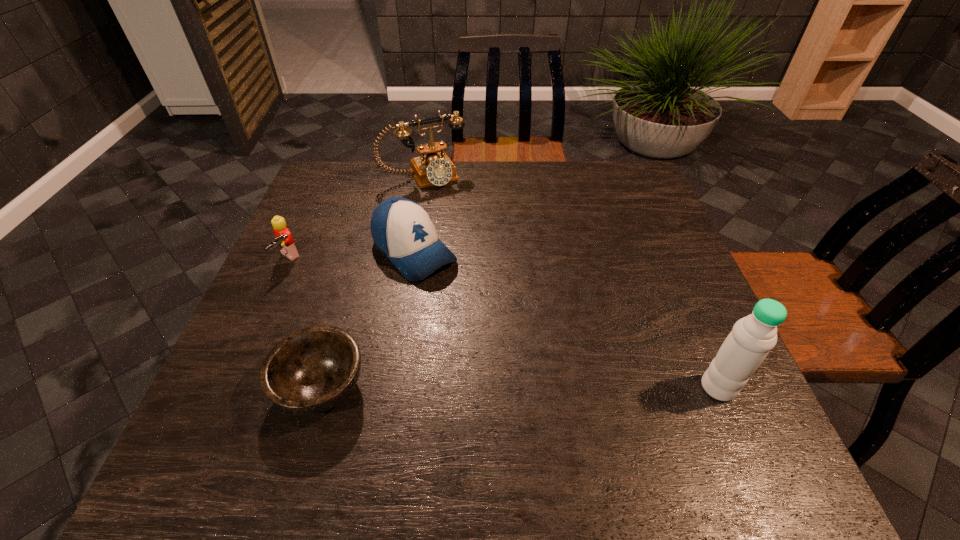
In the image, there is a desktop. At what (x,y) coordinates should I click in order to perform the action: click on free space at the near left corner. Please return your answer as a coordinate pair (x, y). Looking at the image, I should click on (231, 381).

The height and width of the screenshot is (540, 960). I want to click on free space at the far right corner of the desktop, so [636, 171].

You are a GUI agent. You are given a task and a screenshot of the screen. Output one action in this format:
    pyautogui.click(x=<x>, y=<y>)
    Task: Click on the vacant area that lies between the Lego and the water bottle
    The width and height of the screenshot is (960, 540).
    Given the screenshot: What is the action you would take?
    pyautogui.click(x=503, y=323)

Where is `empty location between the Lego and the farthest object`? The image size is (960, 540). empty location between the Lego and the farthest object is located at coordinates (356, 218).

Where is `free spot between the shortest object and the rightmost object`? free spot between the shortest object and the rightmost object is located at coordinates (520, 387).

You are a GUI agent. You are given a task and a screenshot of the screen. Output one action in this format:
    pyautogui.click(x=<x>, y=<y>)
    Task: Click on the free space between the shortest object and the Lego
    The height and width of the screenshot is (540, 960).
    Given the screenshot: What is the action you would take?
    pyautogui.click(x=305, y=323)

Locate an element on the screen. The width and height of the screenshot is (960, 540). unoccupied position between the shortest object and the water bottle is located at coordinates (520, 387).

I want to click on vacant region between the Lego and the rightmost object, so (x=503, y=323).

Find the location of a particular element. The image size is (960, 540). empty space that is in between the bowl and the baseball cap is located at coordinates (368, 320).

You are a GUI agent. You are given a task and a screenshot of the screen. Output one action in this format:
    pyautogui.click(x=<x>, y=<y>)
    Task: Click on the free space between the rightmost object and the telephone
    This screenshot has width=960, height=540.
    Given the screenshot: What is the action you would take?
    pyautogui.click(x=571, y=282)